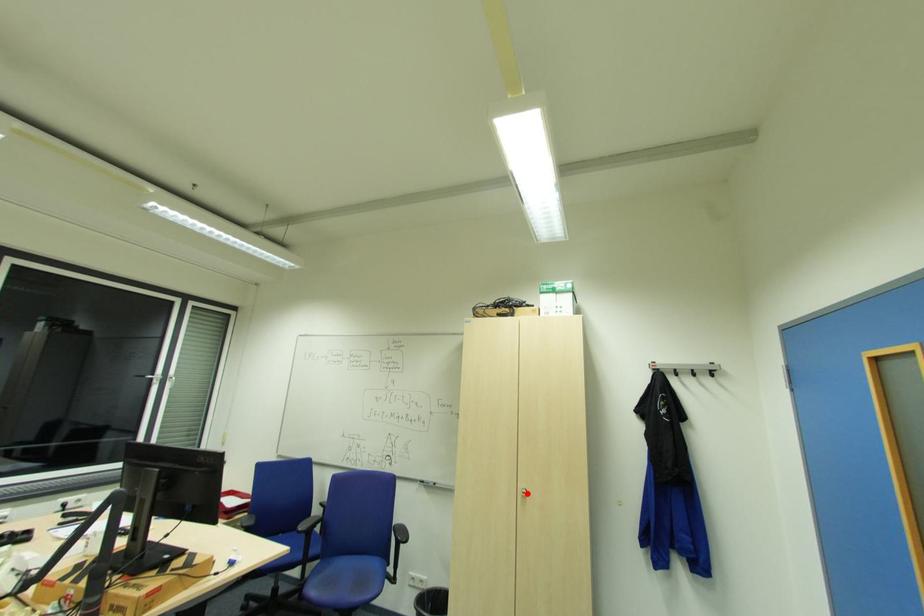
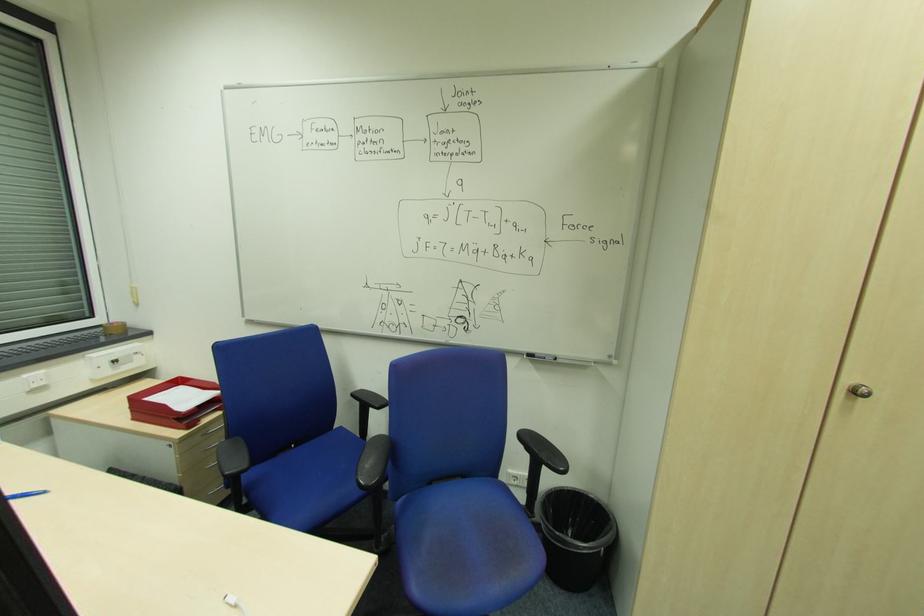
Question: I am providing you with two images of the same scene from different viewpoints. A red point is marked on the first image. Is the red point's position out of view in image 2?

Choices:
 (A) Yes
 (B) No

Answer: (B)